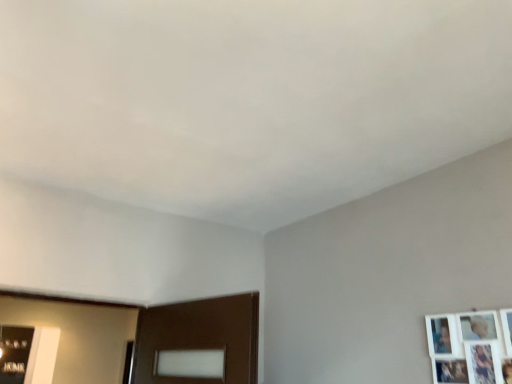
In order to click on metallic silver picture frame at lower left, which appears as the second picture frame when viewed from the right in this screenshot , I will do `click(14, 353)`.

The width and height of the screenshot is (512, 384). What do you see at coordinates (14, 353) in the screenshot?
I see `metallic silver picture frame at lower left, which is the first picture frame in bottom-to-top order` at bounding box center [14, 353].

Describe the element at coordinates (468, 348) in the screenshot. Image resolution: width=512 pixels, height=384 pixels. I see `white matte picture frame at upper right, which is the first picture frame in top-to-bottom order` at that location.

Locate an element on the screen. Image resolution: width=512 pixels, height=384 pixels. white matte picture frame at upper right, which ranks as the second picture frame in left-to-right order is located at coordinates (468, 348).

This screenshot has height=384, width=512. In order to click on metallic silver picture frame at lower left, marked as the second picture frame in a front-to-back arrangement in this screenshot , I will do `click(14, 353)`.

Is white matte picture frame at upper right, placed as the second picture frame when sorted from bottom to top, at the left side of metallic silver picture frame at lower left, which is the first picture frame in left-to-right order?

No, white matte picture frame at upper right, placed as the second picture frame when sorted from bottom to top, is not to the left of metallic silver picture frame at lower left, which is the first picture frame in left-to-right order.

Is white matte picture frame at upper right, which ranks as the first picture frame in right-to-left order, closer to camera compared to metallic silver picture frame at lower left, marked as the second picture frame in a front-to-back arrangement?

Yes, it is in front of metallic silver picture frame at lower left, marked as the second picture frame in a front-to-back arrangement.

Which point is more distant from viewer, (x=476, y=361) or (x=17, y=339)?

The point (x=17, y=339) is behind.

From the image's perspective, is white matte picture frame at upper right, which ranks as the first picture frame in right-to-left order, located beneath metallic silver picture frame at lower left, marked as the second picture frame in a front-to-back arrangement?

Incorrect, from the image's perspective, white matte picture frame at upper right, which ranks as the first picture frame in right-to-left order, is higher than metallic silver picture frame at lower left, marked as the second picture frame in a front-to-back arrangement.

From the picture: From a real-world perspective, who is located lower, white matte picture frame at upper right, positioned as the first picture frame in front-to-back order, or metallic silver picture frame at lower left, marked as the second picture frame in a front-to-back arrangement?

white matte picture frame at upper right, positioned as the first picture frame in front-to-back order, is physically lower.

Considering the sizes of white matte picture frame at upper right, which ranks as the second picture frame in back-to-front order, and metallic silver picture frame at lower left, arranged as the second picture frame when viewed from the top, in the image, is white matte picture frame at upper right, which ranks as the second picture frame in back-to-front order, wider or thinner than metallic silver picture frame at lower left, arranged as the second picture frame when viewed from the top,?

Clearly, white matte picture frame at upper right, which ranks as the second picture frame in back-to-front order, has less width compared to metallic silver picture frame at lower left, arranged as the second picture frame when viewed from the top.

Considering the relative sizes of white matte picture frame at upper right, which ranks as the second picture frame in back-to-front order, and metallic silver picture frame at lower left, marked as the second picture frame in a front-to-back arrangement, in the image provided, is white matte picture frame at upper right, which ranks as the second picture frame in back-to-front order, taller than metallic silver picture frame at lower left, marked as the second picture frame in a front-to-back arrangement,?

In fact, white matte picture frame at upper right, which ranks as the second picture frame in back-to-front order, may be shorter than metallic silver picture frame at lower left, marked as the second picture frame in a front-to-back arrangement.

Does white matte picture frame at upper right, which ranks as the first picture frame in right-to-left order, have a larger size compared to metallic silver picture frame at lower left, which is the first picture frame from back to front?

No.

Do you think white matte picture frame at upper right, which ranks as the first picture frame in right-to-left order, is within metallic silver picture frame at lower left, which is the first picture frame in left-to-right order, or outside of it?

white matte picture frame at upper right, which ranks as the first picture frame in right-to-left order, is not inside metallic silver picture frame at lower left, which is the first picture frame in left-to-right order, it's outside.

Are white matte picture frame at upper right, which ranks as the second picture frame in back-to-front order, and metallic silver picture frame at lower left, which is the first picture frame in left-to-right order, far apart?

Yes, white matte picture frame at upper right, which ranks as the second picture frame in back-to-front order, is far from metallic silver picture frame at lower left, which is the first picture frame in left-to-right order.

Is white matte picture frame at upper right, which ranks as the first picture frame in right-to-left order, facing towards metallic silver picture frame at lower left, which is the first picture frame in left-to-right order?

No, white matte picture frame at upper right, which ranks as the first picture frame in right-to-left order, is not aimed at metallic silver picture frame at lower left, which is the first picture frame in left-to-right order.

You are a GUI agent. You are given a task and a screenshot of the screen. Output one action in this format:
    pyautogui.click(x=<x>, y=<y>)
    Task: Click on the picture frame lying above the metallic silver picture frame at lower left, which is the first picture frame in bottom-to-top order (from the image's perspective)
    This screenshot has height=384, width=512.
    Given the screenshot: What is the action you would take?
    pyautogui.click(x=468, y=348)

Between metallic silver picture frame at lower left, which is the first picture frame in left-to-right order, and white matte picture frame at upper right, positioned as the first picture frame in front-to-back order, which one appears on the right side from the viewer's perspective?

From the viewer's perspective, white matte picture frame at upper right, positioned as the first picture frame in front-to-back order, appears more on the right side.

Is metallic silver picture frame at lower left, marked as the second picture frame in a front-to-back arrangement, positioned behind white matte picture frame at upper right, which ranks as the second picture frame in left-to-right order?

Yes, metallic silver picture frame at lower left, marked as the second picture frame in a front-to-back arrangement, is behind white matte picture frame at upper right, which ranks as the second picture frame in left-to-right order.

Between point (10, 357) and point (426, 319), which one is positioned in front?

The point (426, 319) is in front.

Based on the photo, from the image's perspective, which one is positioned lower, metallic silver picture frame at lower left, marked as the second picture frame in a front-to-back arrangement, or white matte picture frame at upper right, which ranks as the second picture frame in back-to-front order?

metallic silver picture frame at lower left, marked as the second picture frame in a front-to-back arrangement, from the image's perspective.

From a real-world perspective, is metallic silver picture frame at lower left, which is the first picture frame from back to front, beneath white matte picture frame at upper right, placed as the second picture frame when sorted from bottom to top?

Actually, metallic silver picture frame at lower left, which is the first picture frame from back to front, is physically above white matte picture frame at upper right, placed as the second picture frame when sorted from bottom to top, in the real world.

Considering the sizes of objects metallic silver picture frame at lower left, which is the first picture frame from back to front, and white matte picture frame at upper right, placed as the second picture frame when sorted from bottom to top, in the image provided, who is wider, metallic silver picture frame at lower left, which is the first picture frame from back to front, or white matte picture frame at upper right, placed as the second picture frame when sorted from bottom to top,?

Wider between the two is metallic silver picture frame at lower left, which is the first picture frame from back to front.

Considering the sizes of objects metallic silver picture frame at lower left, which is the first picture frame in left-to-right order, and white matte picture frame at upper right, which ranks as the second picture frame in left-to-right order, in the image provided, who is shorter, metallic silver picture frame at lower left, which is the first picture frame in left-to-right order, or white matte picture frame at upper right, which ranks as the second picture frame in left-to-right order,?

With less height is white matte picture frame at upper right, which ranks as the second picture frame in left-to-right order.

Based on their sizes in the image, would you say metallic silver picture frame at lower left, which is the first picture frame in left-to-right order, is bigger or smaller than white matte picture frame at upper right, which ranks as the second picture frame in back-to-front order?

Considering their sizes, metallic silver picture frame at lower left, which is the first picture frame in left-to-right order, takes up more space than white matte picture frame at upper right, which ranks as the second picture frame in back-to-front order.

Choose the correct answer: Is metallic silver picture frame at lower left, which is the first picture frame in bottom-to-top order, inside white matte picture frame at upper right, which ranks as the second picture frame in left-to-right order, or outside it?

metallic silver picture frame at lower left, which is the first picture frame in bottom-to-top order, is outside white matte picture frame at upper right, which ranks as the second picture frame in left-to-right order.

Would you say metallic silver picture frame at lower left, which is the first picture frame from back to front, is a long distance from white matte picture frame at upper right, positioned as the first picture frame in front-to-back order?

Yes, metallic silver picture frame at lower left, which is the first picture frame from back to front, is far from white matte picture frame at upper right, positioned as the first picture frame in front-to-back order.

Does metallic silver picture frame at lower left, which is the first picture frame in left-to-right order, turn towards white matte picture frame at upper right, positioned as the first picture frame in front-to-back order?

Yes.

What's the angular difference between metallic silver picture frame at lower left, arranged as the second picture frame when viewed from the top, and white matte picture frame at upper right, placed as the second picture frame when sorted from bottom to top,'s facing directions?

The angle between the facing direction of metallic silver picture frame at lower left, arranged as the second picture frame when viewed from the top, and the facing direction of white matte picture frame at upper right, placed as the second picture frame when sorted from bottom to top, is 89.3 degrees.

The width and height of the screenshot is (512, 384). Identify the location of picture frame that is behind the white matte picture frame at upper right, which ranks as the second picture frame in back-to-front order. (14, 353).

Where is `picture frame lying behind the white matte picture frame at upper right, which ranks as the first picture frame in right-to-left order`? The width and height of the screenshot is (512, 384). picture frame lying behind the white matte picture frame at upper right, which ranks as the first picture frame in right-to-left order is located at coordinates (14, 353).

At what (x,y) coordinates should I click in order to perform the action: click on picture frame above the white matte picture frame at upper right, placed as the second picture frame when sorted from bottom to top (from a real-world perspective). Please return your answer as a coordinate pair (x, y). The width and height of the screenshot is (512, 384). Looking at the image, I should click on (14, 353).